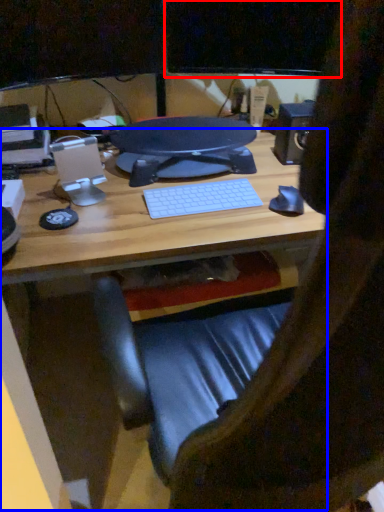
Question: Which object appears farthest to the camera in this image, computer monitor (highlighted by a red box) or desk (highlighted by a blue box)?

Choices:
 (A) computer monitor
 (B) desk

Answer: (A)